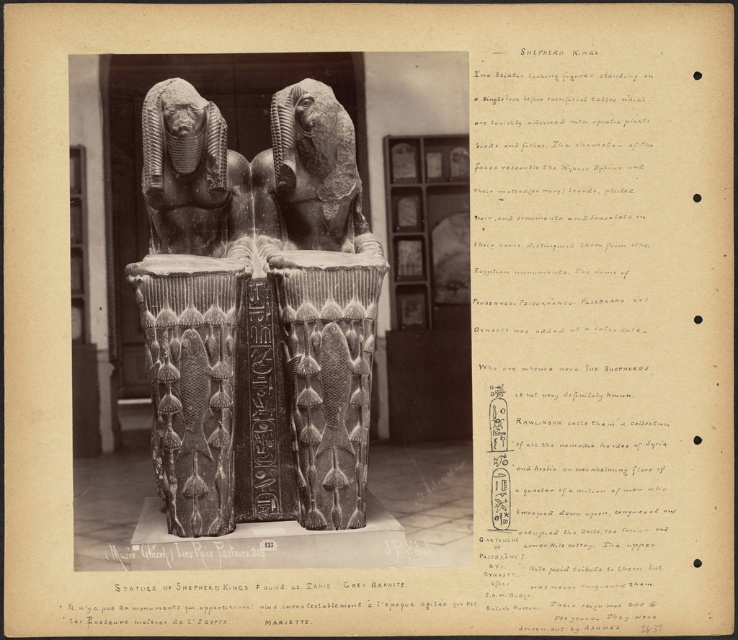
You are a museum curator planning to install a protective glass barrier between the dark gray stone sphinx at center and the gray granite statue at center. Based on their positions, which statue should the barrier be closer to?

The dark gray stone sphinx at center is in front of the gray granite statue at center, so the barrier should be placed closer to the gray granite statue at center to ensure both are protected.

From the picture: You are a museum curator planning to move the gray granite sphinxes at center and the gray granite statue at center to a new exhibition hall. The doorway to the new hall has a width of 1.2 meters. Based on the information provided, can you determine if both objects can pass through the doorway without any adjustments?

The gray granite sphinxes at center might be wider than the gray granite statue at center. However, since the exact width of the sphinxes or the statue is not provided, it is uncertain whether they can pass through the 1.2 meter doorway. Further measurements are needed to confirm their dimensions.

You are a museum curator planning to install a protective glass barrier between the two statues. The barrier must be placed exactly halfway between them. Given that the distance between the gray granite sphinxes at center and the gray granite statue at center is 4.49 inches, how wide should the barrier be to ensure it fits perfectly without touching either statue?

The barrier should be 2.245 inches wide, as it needs to be placed exactly halfway between the two statues which are 4.49 inches apart. Half of 4.49 is 2.245, so the barrier must be that width to fit perfectly between the gray granite sphinxes at center and the gray granite statue at center.